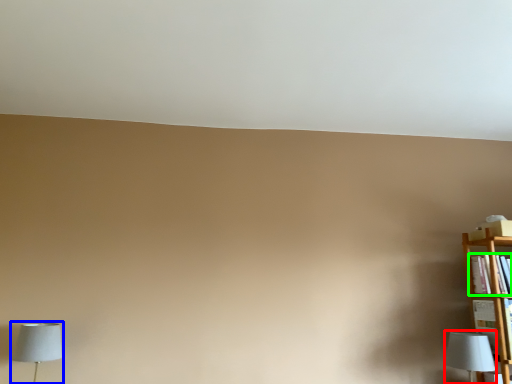
Question: Which object is positioned closest to lamp (highlighted by a red box)? Select from lamp (highlighted by a blue box) and book (highlighted by a green box).

Choices:
 (A) lamp
 (B) book

Answer: (B)